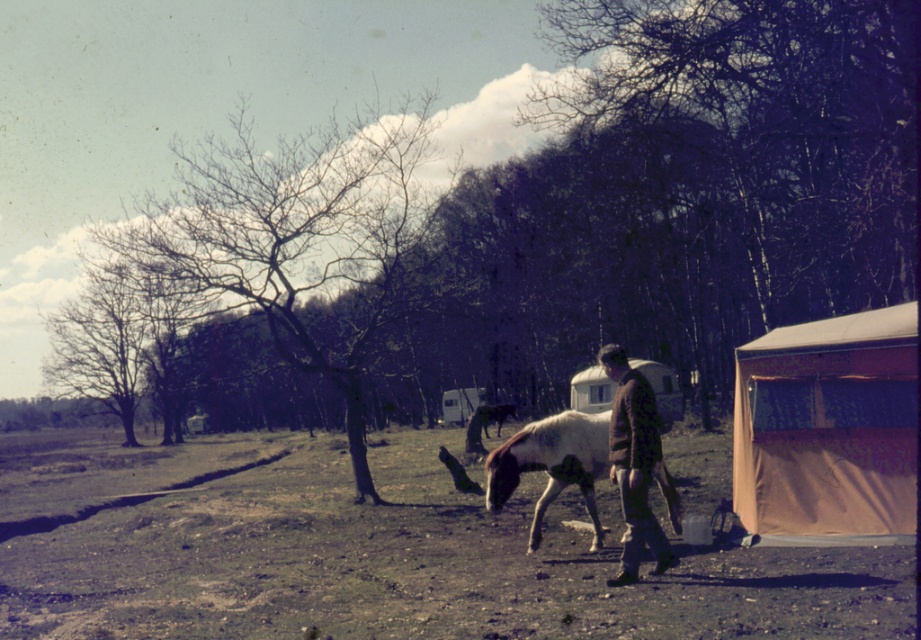
You are planning to set up a picnic and have a basket with you. You see the brown dirt field at lower center and the tan canvas tent at lower right. Which location would be better for the picnic if you want to be closer to the tent?

The tan canvas tent at lower right is positioned to the right of the brown dirt field at lower center, so setting up the picnic near the tan canvas tent at lower right would be closer to the tent.

You are a photographer setting up a tripod in the center of the scene. You notice the white and brown speckled horse at center and the brown woolen sweater at center. Which object should you adjust your camera focus on if you want to capture the taller one?

The brown woolen sweater at center is taller than the white and brown speckled horse at center, so you should focus on the brown woolen sweater at center.

You are planning to set up a temporary campsite in the rural area shown. You have the brown dirt field at lower center and the tan canvas tent at lower right available. Which location would allow you to set up a wider campsite? Please explain your reasoning based on the scene description.

The brown dirt field at lower center is wider than the tan canvas tent at lower right, so it would allow for a wider campsite setup.